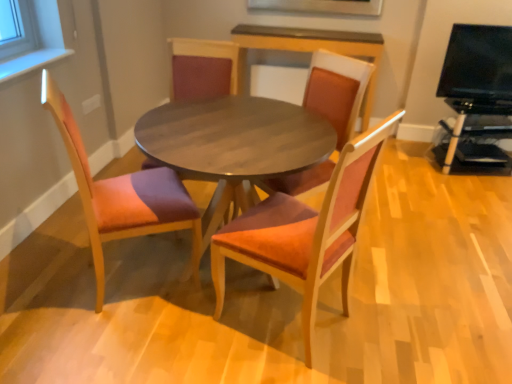
Question: Is wooden table at center turned away from orange fabric chair at left, the fourth chair viewed from the right?

Choices:
 (A) yes
 (B) no

Answer: (B)

Question: Is wooden table at center not inside orange fabric chair at left, the fourth chair viewed from the right?

Choices:
 (A) yes
 (B) no

Answer: (A)

Question: Is wooden table at center wider than orange fabric chair at left, the first chair from the left?

Choices:
 (A) yes
 (B) no

Answer: (A)

Question: Can you confirm if wooden table at center is taller than orange fabric chair at left, the fourth chair viewed from the right?

Choices:
 (A) no
 (B) yes

Answer: (A)

Question: Is orange fabric chair at left, the fourth chair viewed from the right, a part of wooden table at center?

Choices:
 (A) yes
 (B) no

Answer: (B)

Question: Is wooden table at center at the right side of orange fabric chair at left, the fourth chair viewed from the right?

Choices:
 (A) no
 (B) yes

Answer: (B)

Question: Is orange fabric chair at left, the first chair from the left, aimed at black plastic entertainment center at right, acting as the 1th entertainment center starting from the bottom?

Choices:
 (A) yes
 (B) no

Answer: (A)

Question: Is orange fabric chair at left, the fourth chair viewed from the right, not close to black plastic entertainment center at right, acting as the 1th entertainment center starting from the bottom?

Choices:
 (A) yes
 (B) no

Answer: (A)

Question: Is orange fabric chair at left, the fourth chair viewed from the right, further to the viewer compared to black plastic entertainment center at right, acting as the 1th entertainment center starting from the bottom?

Choices:
 (A) no
 (B) yes

Answer: (A)

Question: From a real-world perspective, is orange fabric chair at left, the fourth chair viewed from the right, on top of black plastic entertainment center at right, which appears as the second entertainment center when viewed from the top?

Choices:
 (A) yes
 (B) no

Answer: (A)

Question: Is orange fabric chair at left, the fourth chair viewed from the right, wider than black plastic entertainment center at right, which appears as the second entertainment center when viewed from the top?

Choices:
 (A) no
 (B) yes

Answer: (B)

Question: Is orange fabric chair at left, the first chair from the left, bigger than black plastic entertainment center at right, which appears as the second entertainment center when viewed from the top?

Choices:
 (A) no
 (B) yes

Answer: (B)

Question: Is matte wood chair at center, which appears as the 3th chair when viewed from the left, taller than black plastic entertainment center at right, which appears as the second entertainment center when viewed from the top?

Choices:
 (A) no
 (B) yes

Answer: (B)